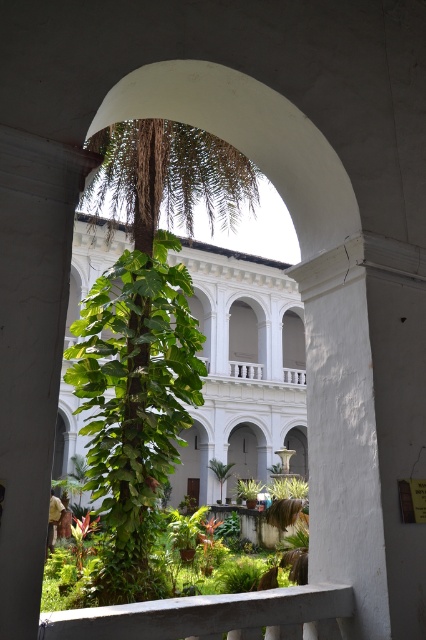
You are a painter standing in the courtyard and want to paint the green leafy plant at center and the white concrete balustrade at lower center. Which object will you need to tilt your head upwards more to view from your current position?

The green leafy plant at center has a greater height compared to the white concrete balustrade at lower center, so you will need to tilt your head upwards more to view the green leafy plant at center.

You are a landscape architect designing a pathway between the green leafy plant at center and the white smooth pillar at right. If the pathway must be wide enough to allow a wheelbarrow to pass through, which object requires more space consideration in terms of its width?

The green leafy plant at center requires more space consideration because its width surpasses that of the white smooth pillar at right, so the pathway must accommodate its greater width to ensure the wheelbarrow can pass safely.

You are standing in the courtyard and want to take a photo of the white concrete balustrade at lower center without the green leafy plant at center blocking it. How should you position yourself?

Move behind the white concrete balustrade at lower center so that it is between you and the green leafy plant at center. Since the balustrade is behind the plant, positioning yourself behind the balustrade will place the plant in front, allowing you to capture the balustrade without obstruction.